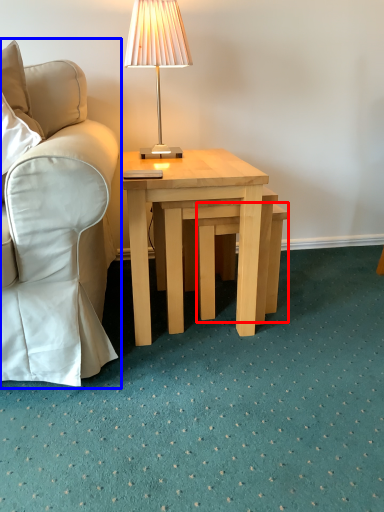
Question: Which object appears farthest to the camera in this image, stool (highlighted by a red box) or chair (highlighted by a blue box)?

Choices:
 (A) stool
 (B) chair

Answer: (A)